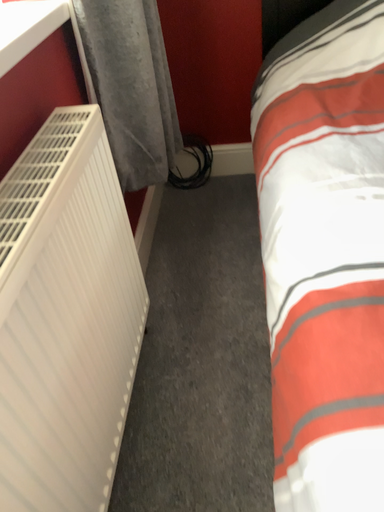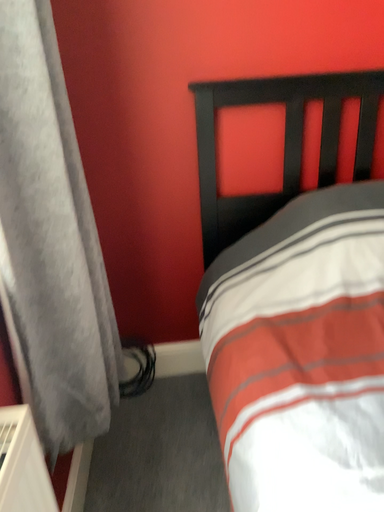
Question: Which way did the camera rotate in the video?

Choices:
 (A) rotated left
 (B) rotated right

Answer: (B)